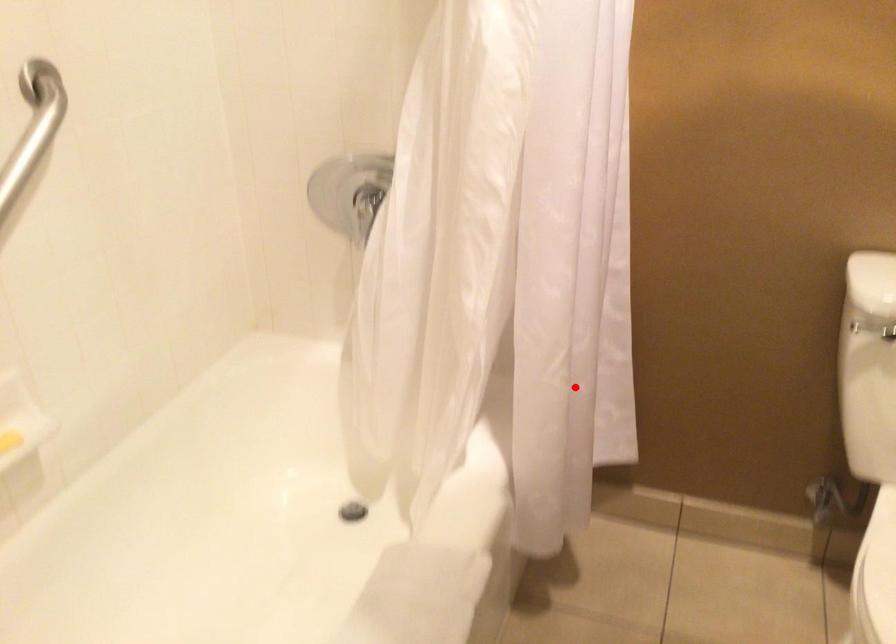
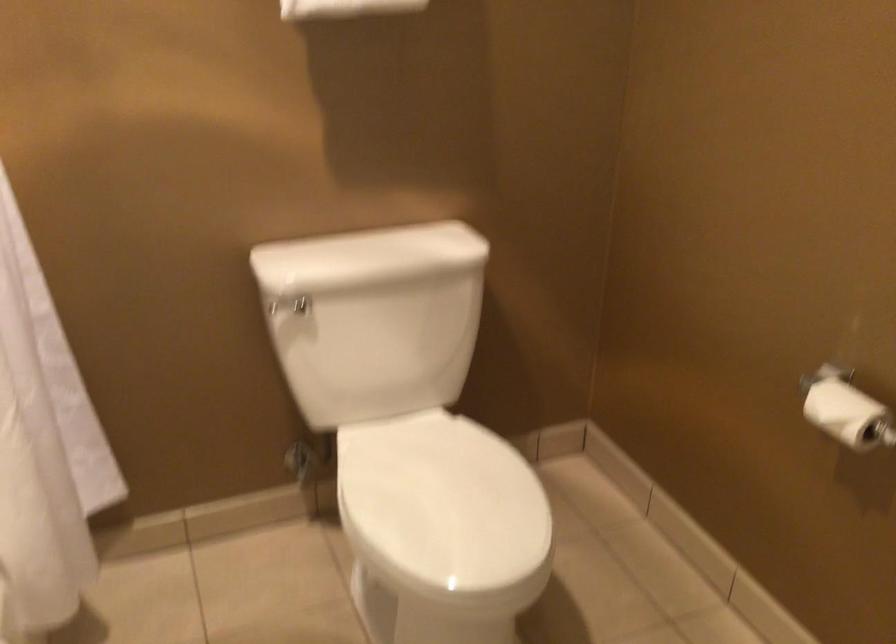
Question: I am providing you with two images of the same scene from different viewpoints. A red point is marked on the first image. Is the red point's position out of view in image 2?

Choices:
 (A) Yes
 (B) No

Answer: (B)